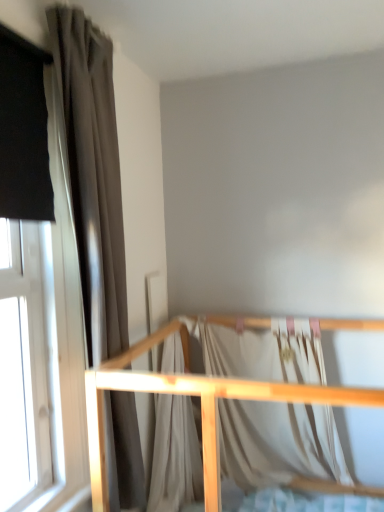
Question: Is silky white fabric at center not near light wood crib rail at lower center?

Choices:
 (A) no
 (B) yes

Answer: (A)

Question: From a real-world perspective, is silky white fabric at center positioned over light wood crib rail at lower center based on gravity?

Choices:
 (A) no
 (B) yes

Answer: (B)

Question: From the image's perspective, would you say silky white fabric at center is shown under light wood crib rail at lower center?

Choices:
 (A) yes
 (B) no

Answer: (B)

Question: Does silky white fabric at center have a lesser width compared to light wood crib rail at lower center?

Choices:
 (A) yes
 (B) no

Answer: (A)

Question: Is silky white fabric at center surrounding light wood crib rail at lower center?

Choices:
 (A) no
 (B) yes

Answer: (A)

Question: From the image's perspective, is silky white fabric at center on top of light wood crib rail at lower center?

Choices:
 (A) yes
 (B) no

Answer: (A)

Question: Is there a large distance between matte gray curtain at left and silky white fabric at center?

Choices:
 (A) no
 (B) yes

Answer: (A)

Question: Can we say matte gray curtain at left lies outside silky white fabric at center?

Choices:
 (A) no
 (B) yes

Answer: (B)

Question: Is matte gray curtain at left next to silky white fabric at center and touching it?

Choices:
 (A) no
 (B) yes

Answer: (A)

Question: Is matte gray curtain at left positioned with its back to silky white fabric at center?

Choices:
 (A) no
 (B) yes

Answer: (A)

Question: Is matte gray curtain at left aimed at silky white fabric at center?

Choices:
 (A) yes
 (B) no

Answer: (B)

Question: Is matte gray curtain at left at the right side of silky white fabric at center?

Choices:
 (A) no
 (B) yes

Answer: (A)

Question: From the image's perspective, is light wood crib rail at lower center under silky white fabric at center?

Choices:
 (A) yes
 (B) no

Answer: (A)